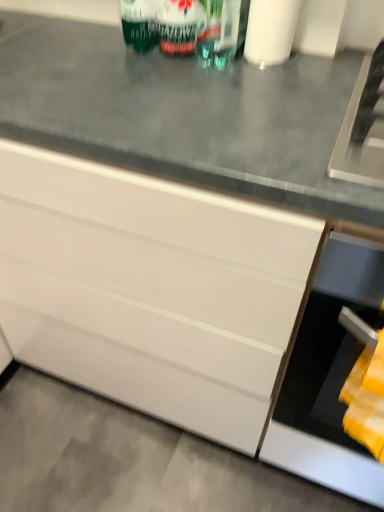
Question: Is black matte oven at lower right located within white glossy cabinet at center?

Choices:
 (A) yes
 (B) no

Answer: (B)

Question: Is white glossy cabinet at center looking in the opposite direction of black matte oven at lower right?

Choices:
 (A) no
 (B) yes

Answer: (A)

Question: Does white glossy cabinet at center have a greater width compared to black matte oven at lower right?

Choices:
 (A) yes
 (B) no

Answer: (A)

Question: Can you confirm if white glossy cabinet at center is thinner than black matte oven at lower right?

Choices:
 (A) no
 (B) yes

Answer: (A)

Question: Can we say white glossy cabinet at center lies outside black matte oven at lower right?

Choices:
 (A) yes
 (B) no

Answer: (A)

Question: From a real-world perspective, is white glossy cabinet at center physically located above or below green matte can at upper center?

Choices:
 (A) below
 (B) above

Answer: (A)

Question: Would you say white glossy cabinet at center is inside or outside green matte can at upper center?

Choices:
 (A) outside
 (B) inside

Answer: (A)

Question: From the image's perspective, is white glossy cabinet at center positioned above or below green matte can at upper center?

Choices:
 (A) below
 (B) above

Answer: (A)

Question: Is white glossy cabinet at center wider or thinner than green matte can at upper center?

Choices:
 (A) wide
 (B) thin

Answer: (A)

Question: Is gray concrete floor at lower left taller or shorter than black matte oven at lower right?

Choices:
 (A) tall
 (B) short

Answer: (B)

Question: Considering their positions, is gray concrete floor at lower left located in front of or behind black matte oven at lower right?

Choices:
 (A) behind
 (B) front

Answer: (B)

Question: From the image's perspective, is gray concrete floor at lower left positioned above or below black matte oven at lower right?

Choices:
 (A) below
 (B) above

Answer: (A)

Question: Is point (117, 433) positioned closer to the camera than point (292, 463)?

Choices:
 (A) closer
 (B) farther

Answer: (B)

Question: Looking at their shapes, would you say green matte can at upper center is wider or thinner than gray concrete floor at lower left?

Choices:
 (A) wide
 (B) thin

Answer: (B)

Question: Is green matte can at upper center in front of or behind gray concrete floor at lower left in the image?

Choices:
 (A) behind
 (B) front

Answer: (B)